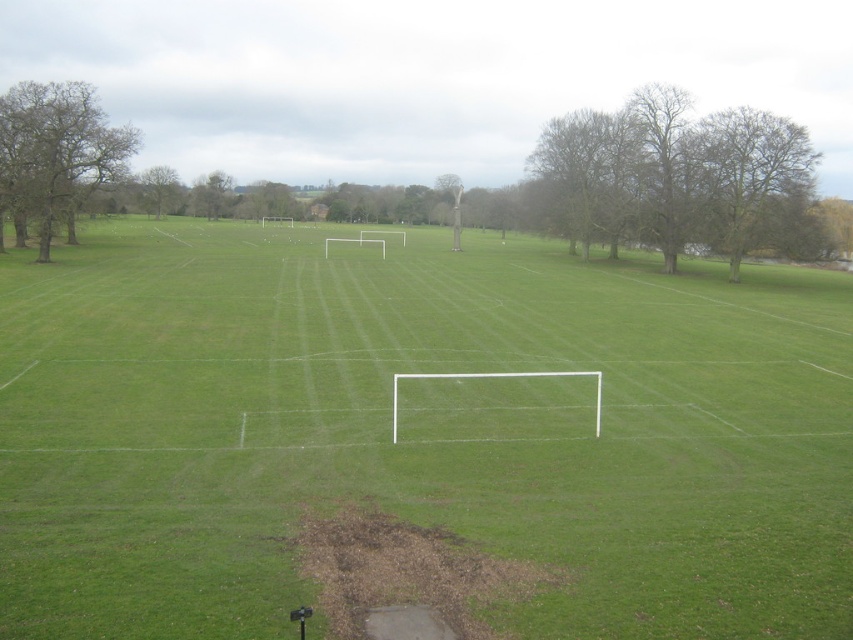
Is bare branches at upper right positioned at the back of brown leafless tree at upper right?

Yes, it is.

Does point (769, 113) lie behind point (776, 211)?

Yes.

Which is behind, point (694, 131) or point (735, 193)?

The point (694, 131) is more distant.

You are a GUI agent. You are given a task and a screenshot of the screen. Output one action in this format:
    pyautogui.click(x=<x>, y=<y>)
    Task: Click on the bare branches at upper right
    
    Given the screenshot: What is the action you would take?
    pyautogui.click(x=677, y=177)

Can you confirm if bare branches at upper right is bigger than green leafy tree at upper left?

Indeed, bare branches at upper right has a larger size compared to green leafy tree at upper left.

Is point (759, 228) in front of point (163, 202)?

Yes, point (759, 228) is in front of point (163, 202).

Identify the location of bare branches at upper right. The height and width of the screenshot is (640, 853). (677, 177).

Which of these two, green smooth grass at center or brown leafless tree at upper right, stands shorter?

green smooth grass at center

Does green smooth grass at center come in front of brown leafless tree at upper right?

Yes, it is.

This screenshot has width=853, height=640. Describe the element at coordinates (416, 429) in the screenshot. I see `green smooth grass at center` at that location.

Where is `green smooth grass at center`? The image size is (853, 640). green smooth grass at center is located at coordinates (416, 429).